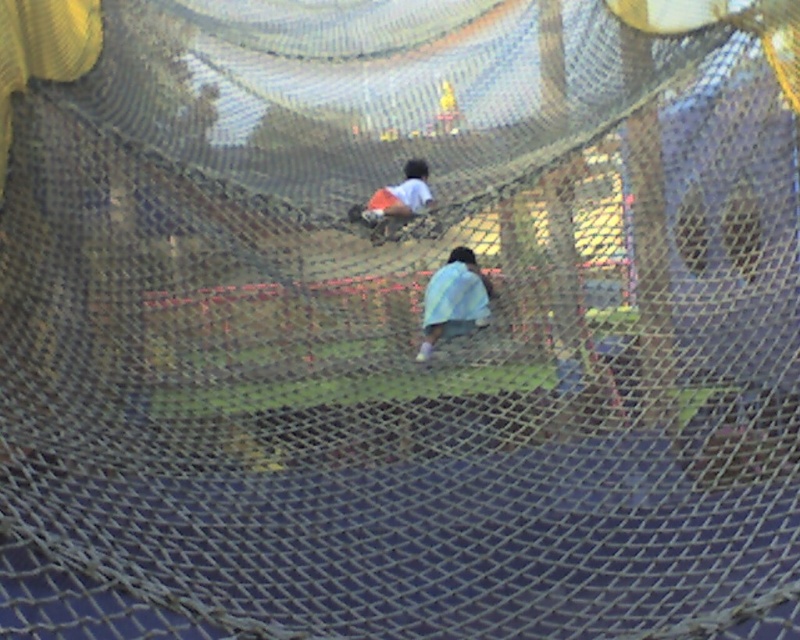
Question: Can you confirm if light blue fabric at center is smaller than orange shorts at center?

Choices:
 (A) yes
 (B) no

Answer: (A)

Question: Which point appears closest to the camera in this image?

Choices:
 (A) (388, 220)
 (B) (425, 288)

Answer: (A)

Question: Can you confirm if light blue fabric at center is smaller than orange shorts at center?

Choices:
 (A) yes
 (B) no

Answer: (A)

Question: Considering the relative positions of light blue fabric at center and orange shorts at center in the image provided, where is light blue fabric at center located with respect to orange shorts at center?

Choices:
 (A) right
 (B) left

Answer: (A)

Question: Which point appears closest to the camera in this image?

Choices:
 (A) (470, 268)
 (B) (354, 205)

Answer: (A)